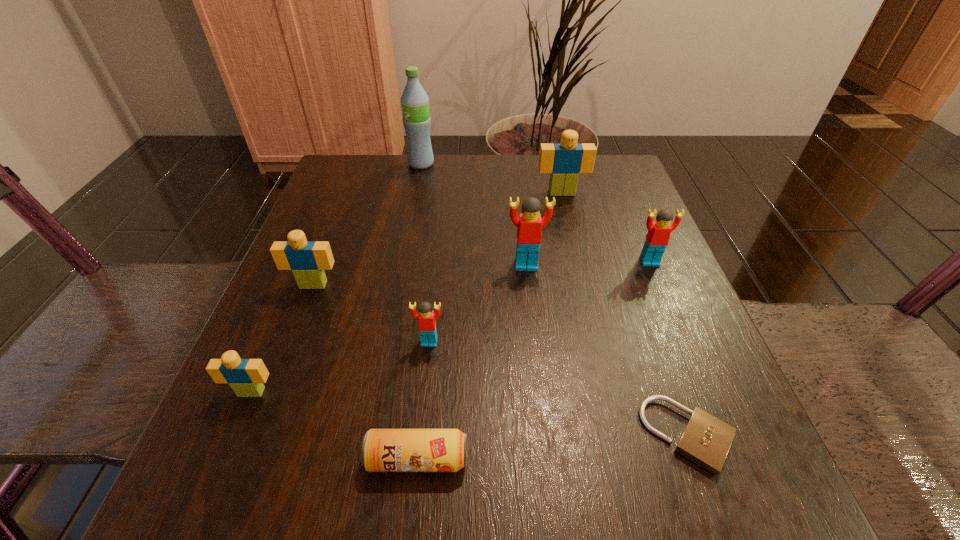
You are a GUI agent. You are given a task and a screenshot of the screen. Output one action in this format:
    pyautogui.click(x=<x>, y=<y>)
    Task: Click on the tallest object
    Image resolution: width=960 pixels, height=540 pixels.
    Given the screenshot: What is the action you would take?
    pyautogui.click(x=415, y=102)

This screenshot has width=960, height=540. Identify the location of the farthest object. (415, 102).

Locate an element on the screen. the rightmost beige Lego is located at coordinates (564, 161).

Find the location of a particular element. This screenshot has height=540, width=960. the biggest beige Lego is located at coordinates (564, 161).

Identify the location of the third Lego from right to left. (529, 225).

You are a GUI agent. You are given a task and a screenshot of the screen. Output one action in this format:
    pyautogui.click(x=<x>, y=<y>)
    Task: Click on the biggest red Lego
    The image size is (960, 540).
    Given the screenshot: What is the action you would take?
    pyautogui.click(x=529, y=225)

You are a GUI agent. You are given a task and a screenshot of the screen. Output one action in this format:
    pyautogui.click(x=<x>, y=<y>)
    Task: Click on the second nearest beige Lego
    This screenshot has height=540, width=960.
    Given the screenshot: What is the action you would take?
    pyautogui.click(x=307, y=259)

Find the location of a particular element. the fifth farthest object is located at coordinates (307, 259).

The image size is (960, 540). I want to click on the rightmost Lego, so click(657, 238).

I want to click on the rightmost red Lego, so click(x=657, y=238).